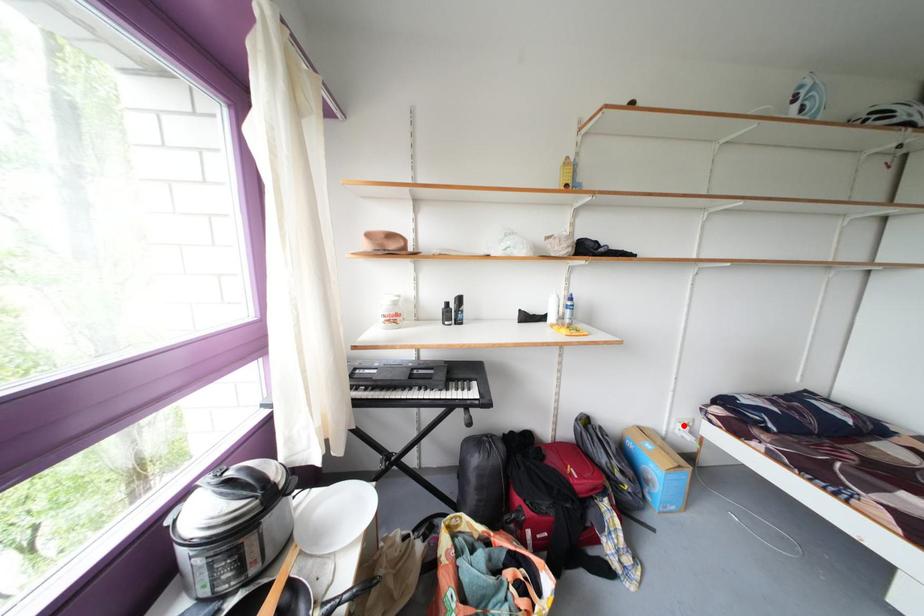
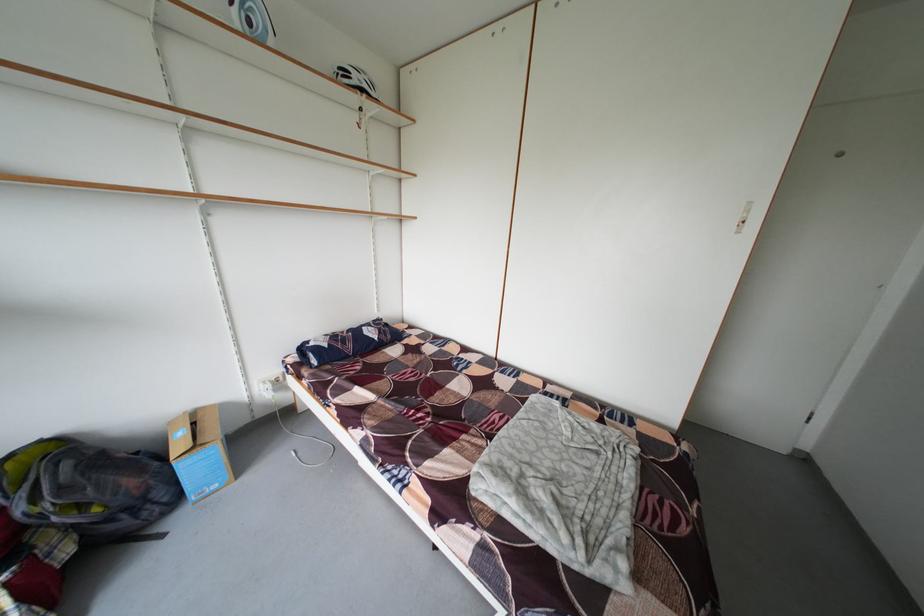
Question: I am providing you with two images of the same scene from different viewpoints. Image1 has a red point marked. In image2, the corresponding 3D location appears at what relative position? Reply with the corresponding letter.

Choices:
 (A) Closer
 (B) Farther

Answer: (B)